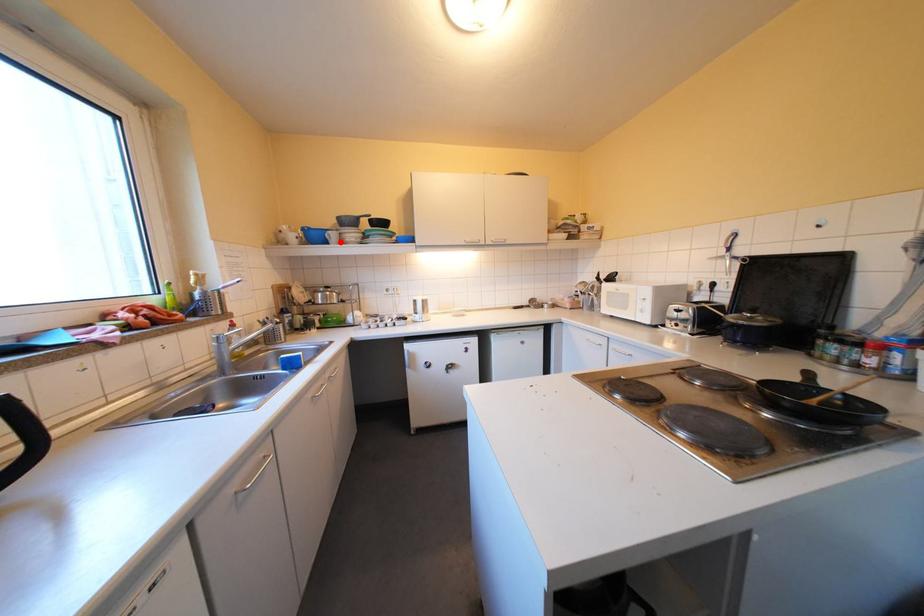
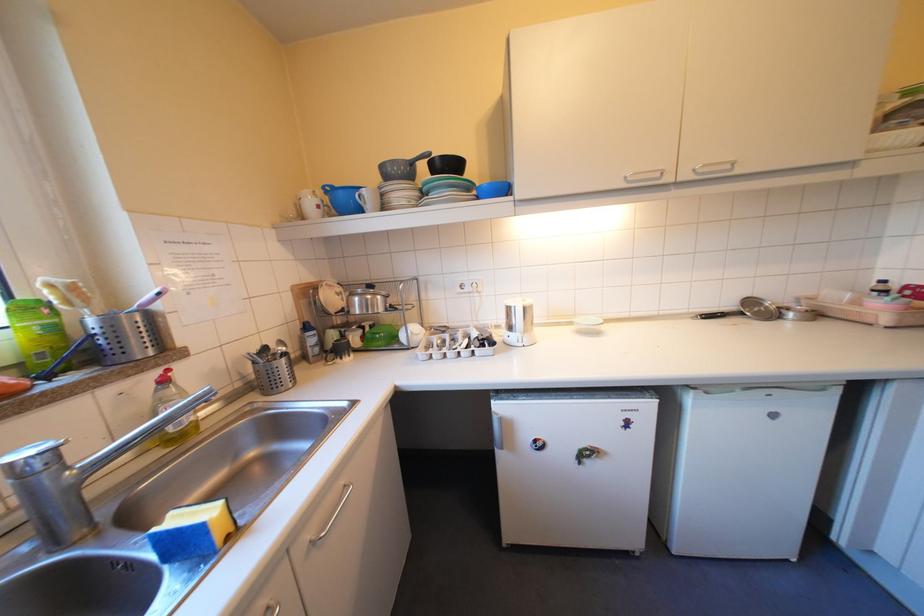
In the second image, find the point that corresponds to the highlighted location in the first image.

(373, 209)